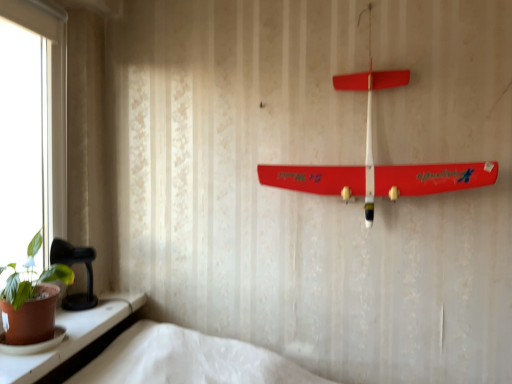
Locate an element on the screen. The width and height of the screenshot is (512, 384). smooth plastic airplane at upper center is located at coordinates (374, 160).

Image resolution: width=512 pixels, height=384 pixels. I want to click on green matte houseplant at lower left, so click(x=31, y=299).

Between smooth plastic airplane at upper center and green matte houseplant at lower left, which one has larger size?

smooth plastic airplane at upper center.

Which is in front, point (319, 182) or point (28, 254)?

The point (319, 182) is closer.

Between smooth plastic airplane at upper center and green matte houseplant at lower left, which one is positioned behind?

smooth plastic airplane at upper center is further away from the camera.

Is smooth plastic airplane at upper center facing towards green matte houseplant at lower left?

No, smooth plastic airplane at upper center does not turn towards green matte houseplant at lower left.

Which point is more forward, [333,77] or [76,332]?

The point [76,332] is more forward.

Which object is closer to the camera, smooth plastic airplane at upper center or matte white window sill at lower left?

matte white window sill at lower left is in front.

Considering the sizes of objects smooth plastic airplane at upper center and matte white window sill at lower left in the image provided, who is bigger, smooth plastic airplane at upper center or matte white window sill at lower left?

With larger size is smooth plastic airplane at upper center.

Would you say smooth plastic airplane at upper center is a long distance from matte white window sill at lower left?

No, there isn't a large distance between smooth plastic airplane at upper center and matte white window sill at lower left.

Can you confirm if green matte houseplant at lower left is smaller than matte white window sill at lower left?

No.

Is green matte houseplant at lower left not within matte white window sill at lower left?

Absolutely, green matte houseplant at lower left is external to matte white window sill at lower left.

Can you confirm if green matte houseplant at lower left is taller than matte white window sill at lower left?

Yes, green matte houseplant at lower left is taller than matte white window sill at lower left.

From the picture: Is green matte houseplant at lower left oriented towards matte white window sill at lower left?

No.

Which is behind, matte white window sill at lower left or green matte houseplant at lower left?

green matte houseplant at lower left.

Is there a large distance between matte white window sill at lower left and green matte houseplant at lower left?

That's not correct — matte white window sill at lower left is a little close to green matte houseplant at lower left.

This screenshot has height=384, width=512. Identify the location of houseplant located on the right of matte white window sill at lower left. (31, 299).

The width and height of the screenshot is (512, 384). What are the coordinates of `toy behind the matte white window sill at lower left` in the screenshot? It's located at (374, 160).

Considering the points (19, 381) and (368, 124), which point is behind, point (19, 381) or point (368, 124)?

The point (368, 124) is more distant.

Is matte white window sill at lower left turned away from smooth plastic airplane at upper center?

No, matte white window sill at lower left is not facing away from smooth plastic airplane at upper center.

Is green matte houseplant at lower left positioned behind smooth plastic airplane at upper center?

No, green matte houseplant at lower left is in front of smooth plastic airplane at upper center.

Is point (13, 337) closer or farther from the camera than point (264, 179)?

Point (13, 337) appears to be closer to the viewer than point (264, 179).

Considering the relative sizes of green matte houseplant at lower left and smooth plastic airplane at upper center in the image provided, is green matte houseplant at lower left smaller than smooth plastic airplane at upper center?

Yes, green matte houseplant at lower left is smaller than smooth plastic airplane at upper center.

Is green matte houseplant at lower left situated inside smooth plastic airplane at upper center or outside?

green matte houseplant at lower left is located beyond the bounds of smooth plastic airplane at upper center.

Find the location of a particular element. The height and width of the screenshot is (384, 512). houseplant in front of the smooth plastic airplane at upper center is located at coordinates (31, 299).

The width and height of the screenshot is (512, 384). In order to click on window below the smooth plastic airplane at upper center (from the image's perspective) in this screenshot , I will do `click(70, 337)`.

From the image, which object appears to be nearer to smooth plastic airplane at upper center, green matte houseplant at lower left or matte white window sill at lower left?

Based on the image, matte white window sill at lower left appears to be nearer to smooth plastic airplane at upper center.

Which object lies nearer to the anchor point matte white window sill at lower left, green matte houseplant at lower left or smooth plastic airplane at upper center?

The object closer to matte white window sill at lower left is green matte houseplant at lower left.

Estimate the real-world distances between objects in this image. Which object is closer to smooth plastic airplane at upper center, matte white window sill at lower left or green matte houseplant at lower left?

matte white window sill at lower left is closer to smooth plastic airplane at upper center.

Considering their positions, is smooth plastic airplane at upper center positioned further to green matte houseplant at lower left than matte white window sill at lower left?

smooth plastic airplane at upper center lies further to green matte houseplant at lower left than the other object.

From the image, which object appears to be nearer to matte white window sill at lower left, smooth plastic airplane at upper center or green matte houseplant at lower left?

green matte houseplant at lower left lies closer to matte white window sill at lower left than the other object.

Which object lies further to the anchor point green matte houseplant at lower left, matte white window sill at lower left or smooth plastic airplane at upper center?

smooth plastic airplane at upper center is positioned further to the anchor green matte houseplant at lower left.

Locate an element on the screen. This screenshot has height=384, width=512. houseplant situated between matte white window sill at lower left and smooth plastic airplane at upper center from left to right is located at coordinates (31, 299).